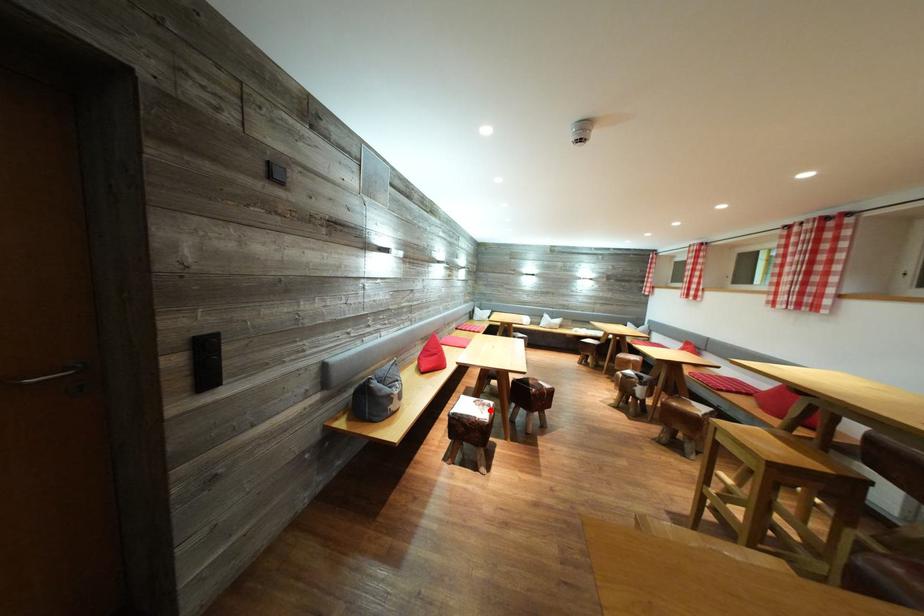
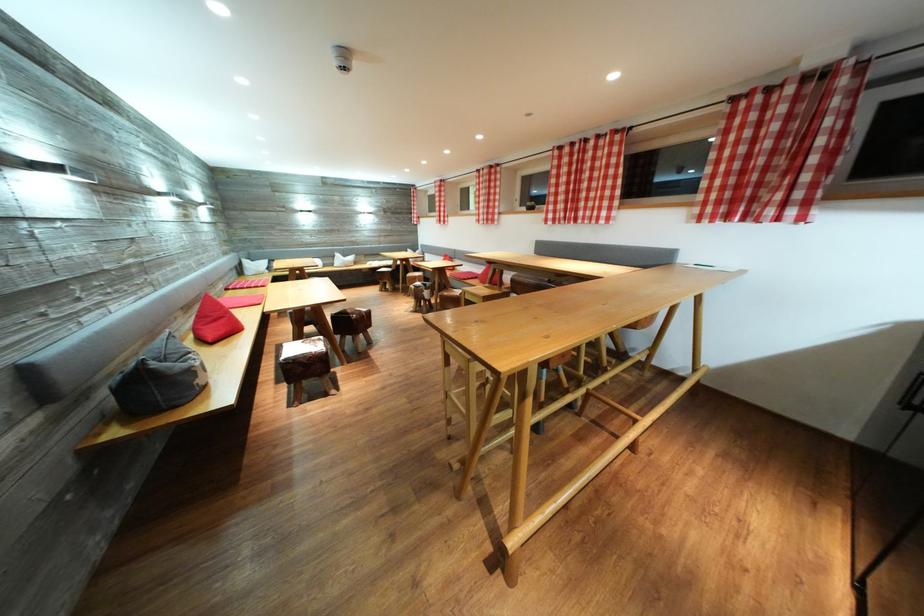
In the second image, find the point that corresponds to the highlighted location in the first image.

(321, 346)